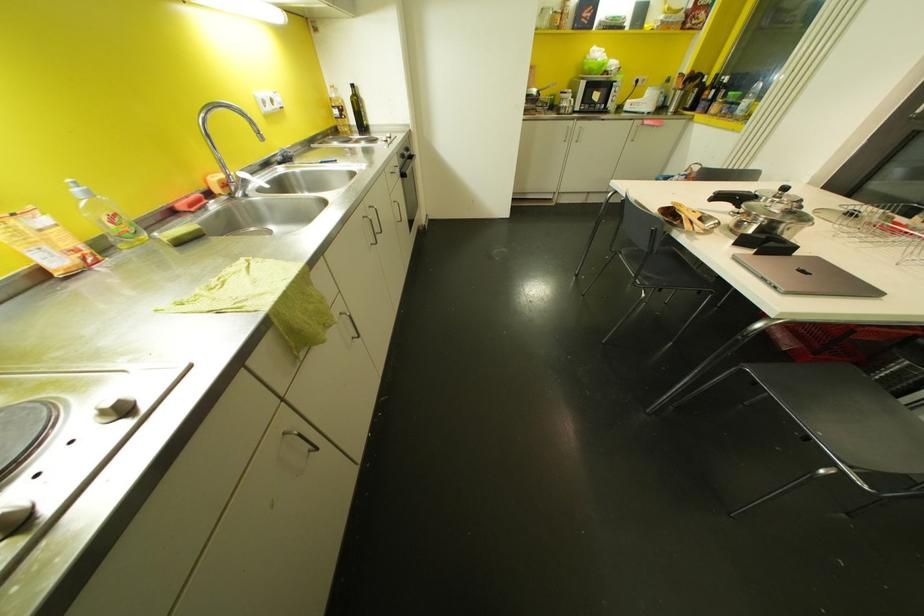
What are the coordinates of `dark glass bottle` in the screenshot? It's located at click(x=359, y=110).